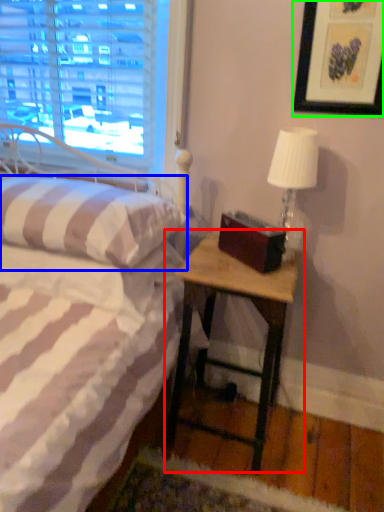
Question: Which object is the farthest from nightstand (highlighted by a red box)? Choose among these: pillow (highlighted by a blue box) or picture frame (highlighted by a green box).

Choices:
 (A) pillow
 (B) picture frame

Answer: (B)